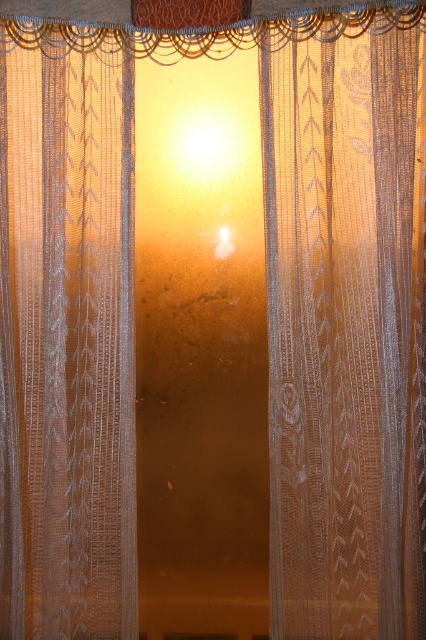
In the scene shown: You are standing in a room with two white lace curtains. You want to hang a small decorative item on the curtain that is closer to the center of the room. Which curtain should you choose between the white lace curtain at center and the white lace curtain at left?

The white lace curtain at center is positioned over the white lace curtain at left, meaning it is closer to the center of the room. Therefore, you should hang the decorative item on the white lace curtain at center.

You are an interior designer planning to hang two white lace curtains in a room. You have the white lace curtain at center and the white lace curtain at left. Which curtain should you choose if you want the taller one for the window?

The white lace curtain at center is taller than the white lace curtain at left, so you should choose the white lace curtain at center for the window.